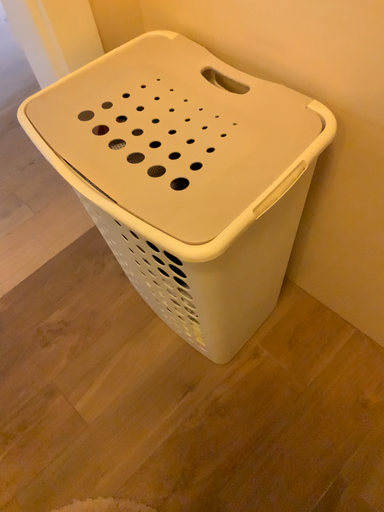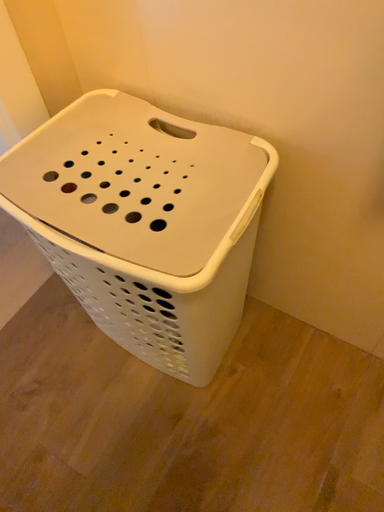
Question: Which way did the camera rotate in the video?

Choices:
 (A) rotated left
 (B) rotated right

Answer: (B)